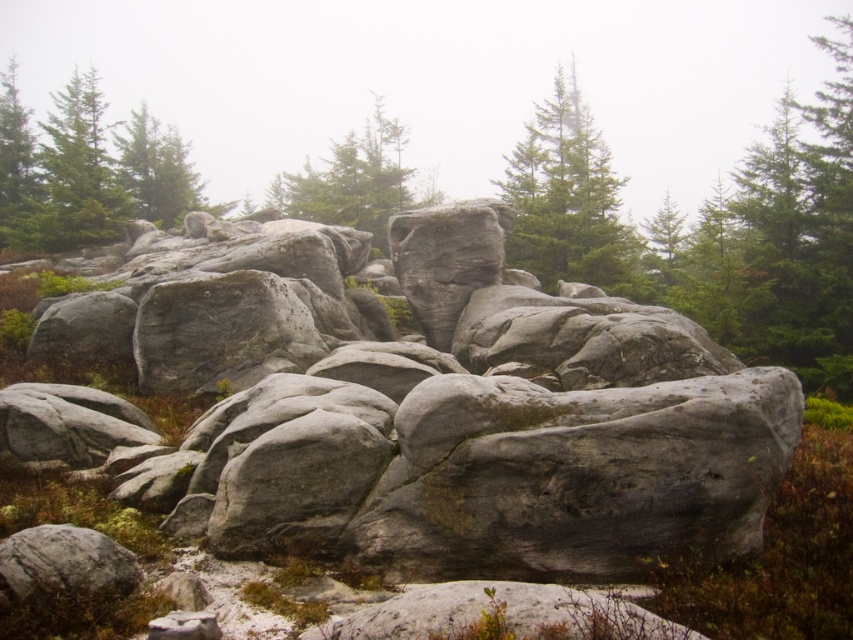
Can you confirm if green matte tree at upper left is thinner than green matte tree at center?

In fact, green matte tree at upper left might be wider than green matte tree at center.

Is green matte tree at upper left further to the viewer compared to green matte tree at center?

Yes, it is behind green matte tree at center.

Where is `green matte tree at upper left`? green matte tree at upper left is located at coordinates [88, 170].

Who is shorter, green matte tree at upper center or green matte tree at center?

green matte tree at center

What do you see at coordinates (567, 198) in the screenshot? I see `green matte tree at upper center` at bounding box center [567, 198].

What are the coordinates of `green matte tree at upper center` in the screenshot? It's located at (567, 198).

Who is positioned more to the left, gray rough rock at center or green matte tree at upper center?

Positioned to the left is gray rough rock at center.

Between point (445, 236) and point (537, 157), which one is positioned in front?

Point (445, 236)

I want to click on gray rough rock at center, so click(x=436, y=406).